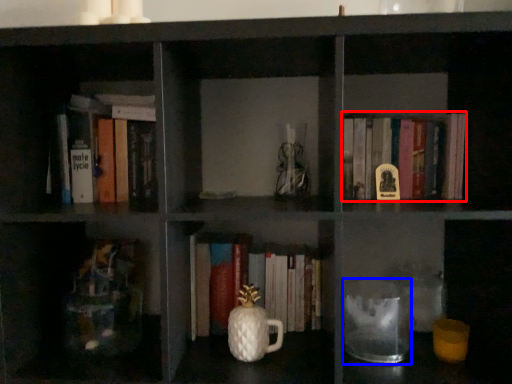
Question: Which of the following is the closest to the observer, book (highlighted by a red box) or glass jar (highlighted by a blue box)?

Choices:
 (A) book
 (B) glass jar

Answer: (B)